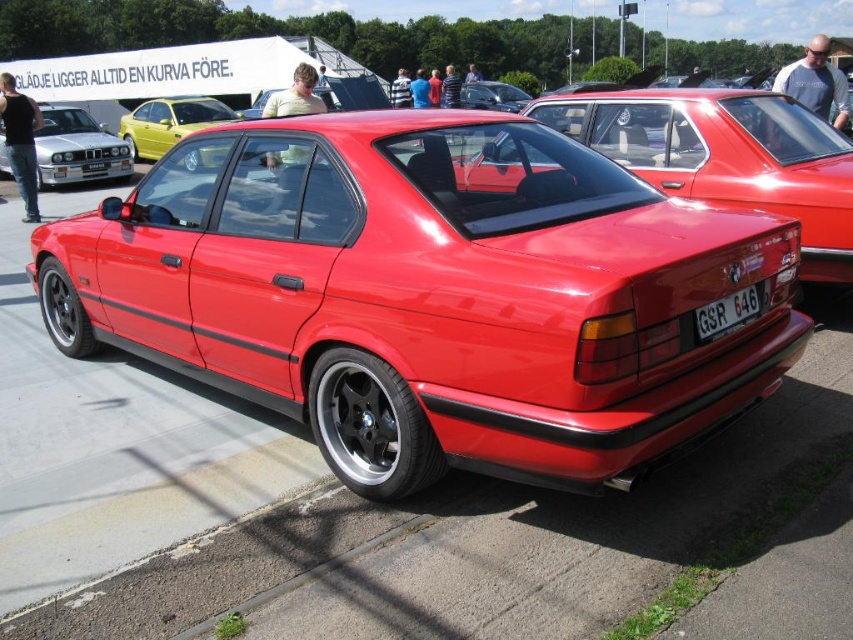
You are a photographer taking pictures of the glossy red car at center and the white plastic license plate at rear. Which object is positioned higher in the image?

The glossy red car at center is positioned above the white plastic license plate at rear, so the glossy red car at center is higher in the image.

You are a photographer at a car show and want to capture both the glossy red car at center and the white plastic license plate at rear in a single frame. Since you can only focus on one object, which one should you choose to ensure it stands out more due to its size?

The glossy red car at center is larger in size than the white plastic license plate at rear, so focusing on the glossy red car at center will make it stand out more in the photo.